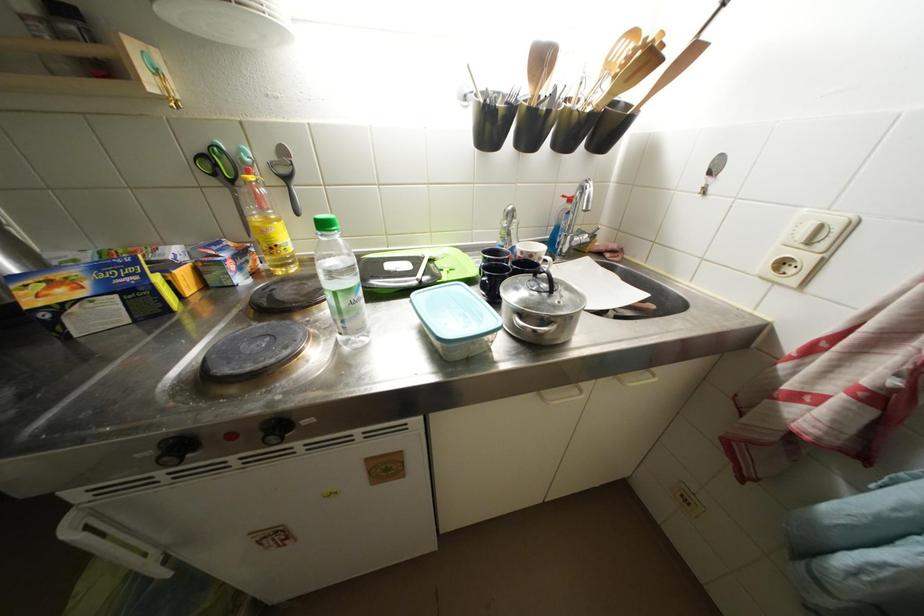
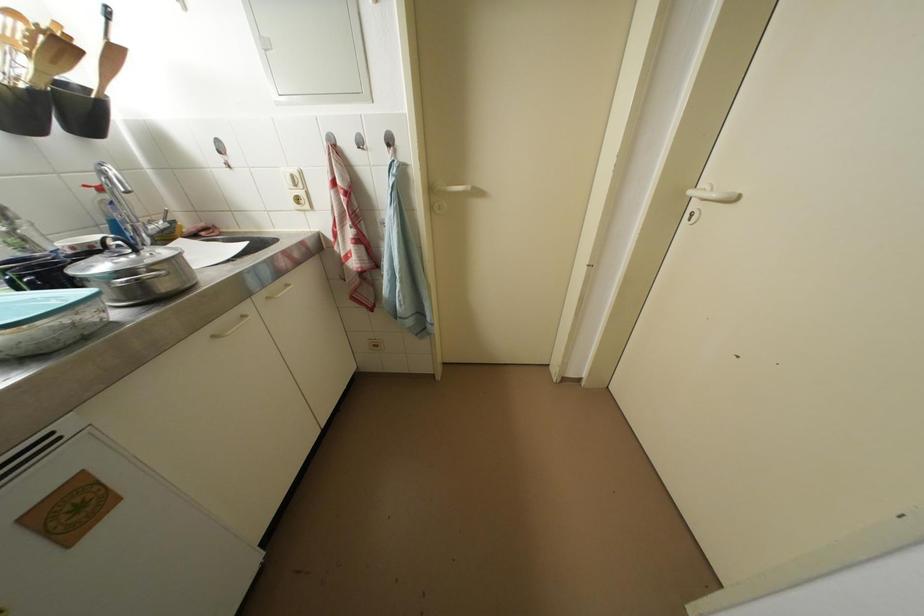
In the second image, find the point that corresponds to pixel 582 243 in the first image.

(157, 231)